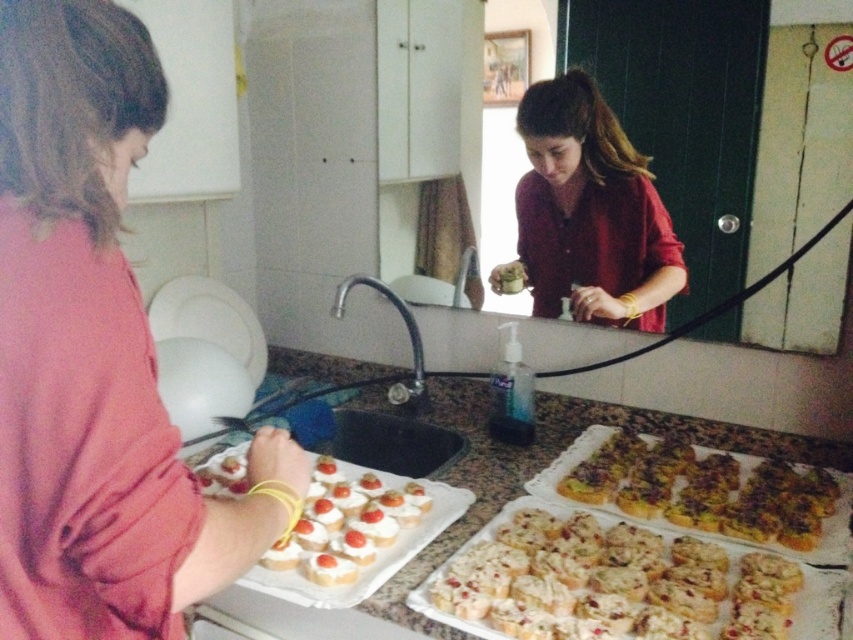
Is white marble tray at lower left positioned at the back of crusty golden bread at lower right?

No.

From the picture: Which of these two, white marble tray at lower left or crusty golden bread at lower right, stands shorter?

crusty golden bread at lower right is shorter.

Between point (318, 356) and point (759, 536), which one is positioned behind?

The point (318, 356) is behind.

Locate an element on the screen. The width and height of the screenshot is (853, 640). white marble tray at lower left is located at coordinates (550, 460).

Is white crumbly at center shorter than white cream cheese canapés at lower left?

Indeed, white crumbly at center has a lesser height compared to white cream cheese canapés at lower left.

Is white crumbly at center bigger than white cream cheese canapés at lower left?

No, white crumbly at center is not bigger than white cream cheese canapés at lower left.

Is point (631, 625) less distant than point (329, 513)?

Yes, point (631, 625) is closer to viewer.

In order to click on white crumbly at center in this screenshot , I will do click(611, 582).

Does matte red blouse at center have a greater width compared to white marble tray at lower left?

Incorrect, matte red blouse at center's width does not surpass white marble tray at lower left's.

Is matte red blouse at center thinner than white marble tray at lower left?

Correct, matte red blouse at center's width is less than white marble tray at lower left's.

Is point (636, 182) in front of point (810, 452)?

No.

Locate an element on the screen. This screenshot has width=853, height=640. matte red blouse at center is located at coordinates (589, 212).